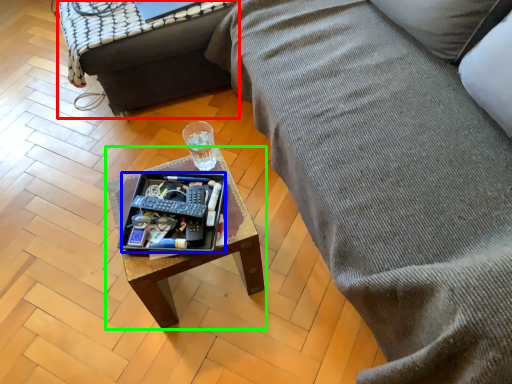
Question: Which is nearer to the table (highlighted by a red box)? tray (highlighted by a blue box) or coffee table (highlighted by a green box).

Choices:
 (A) tray
 (B) coffee table

Answer: (B)